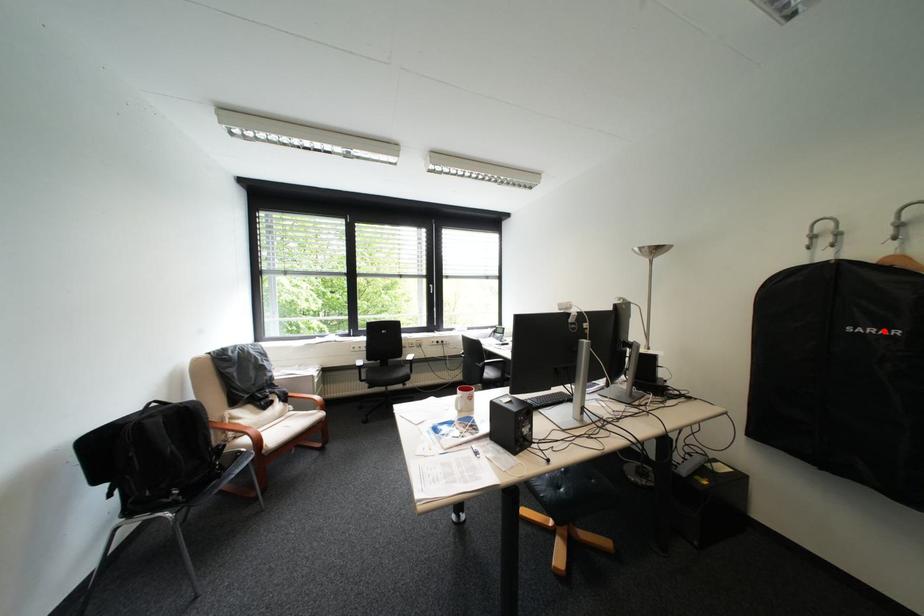
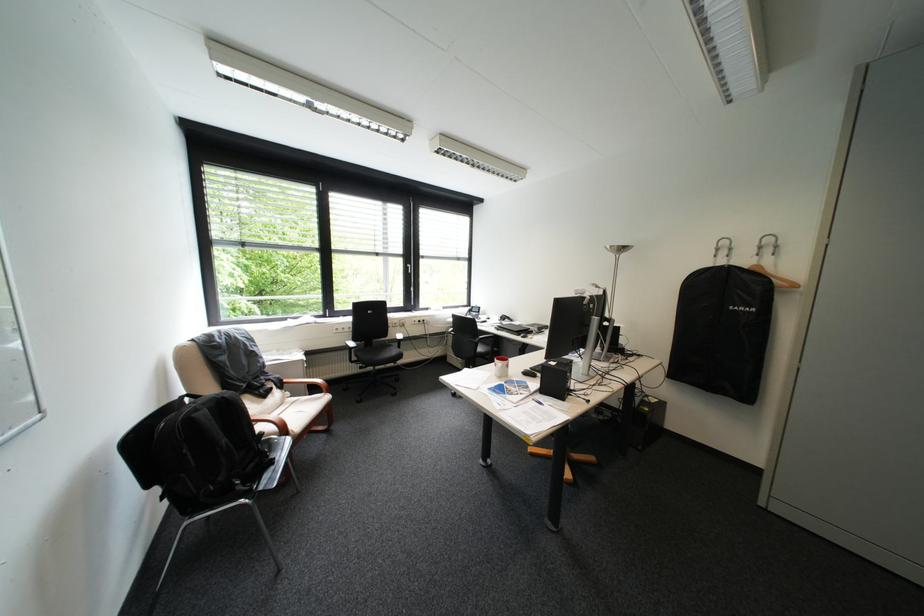
The point at the highlighted location is marked in the first image. Where is the corresponding point in the second image?

(755, 309)